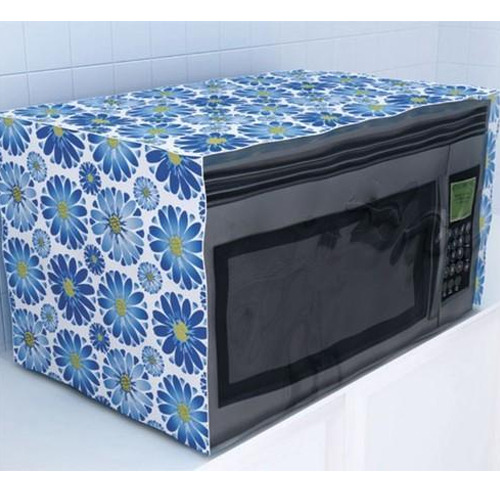
In order to click on white counter in this screenshot , I will do pos(396,411), pos(46,420).